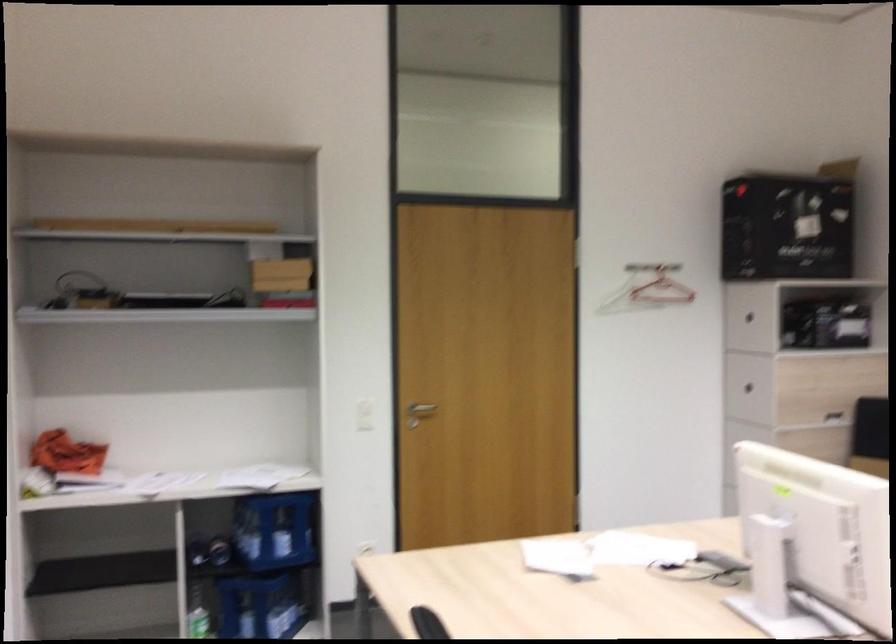
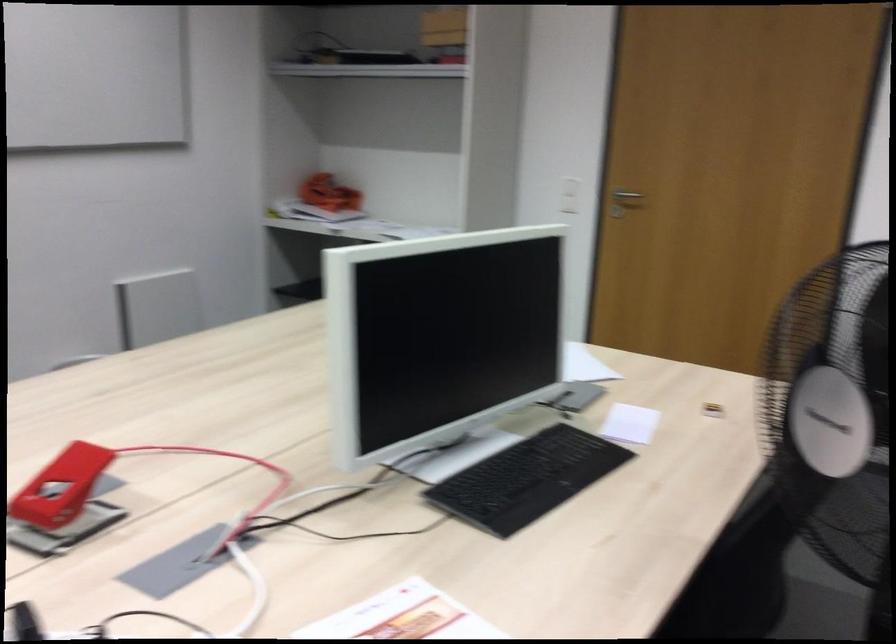
Locate, in the second image, the point that corresponds to (x=256, y=275) in the first image.

(444, 26)